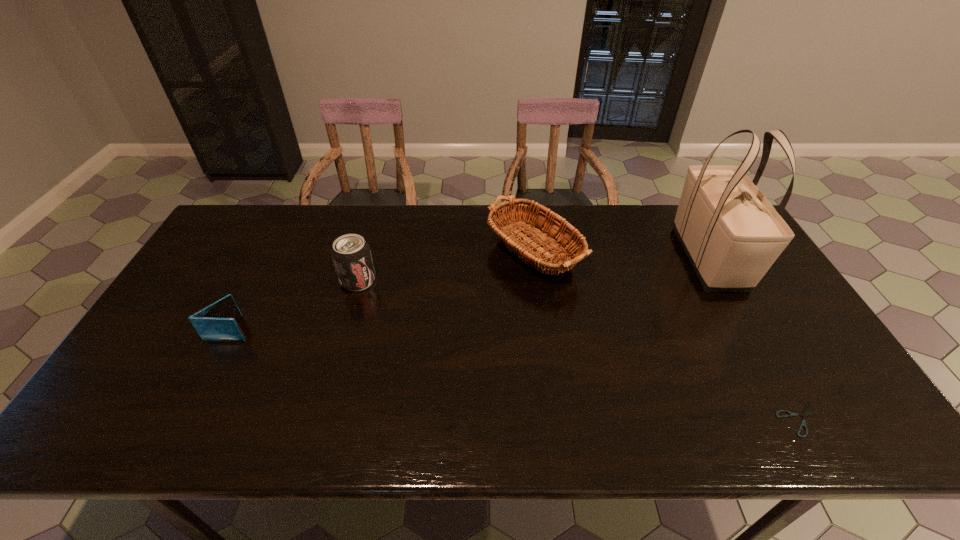
The height and width of the screenshot is (540, 960). I want to click on vacant space situated on the exterior surface of the leftmost object, so click(282, 329).

The image size is (960, 540). I want to click on free space located 0.230m on the back of the shears, so click(749, 325).

At what (x,y) coordinates should I click in order to perform the action: click on shopping bag situated at the far edge. Please return your answer as a coordinate pair (x, y). Looking at the image, I should click on (732, 235).

Identify the location of basket present at the far edge. This screenshot has width=960, height=540. 541,227.

This screenshot has width=960, height=540. Find the location of `object located in the near edge section of the desktop`. object located in the near edge section of the desktop is located at coordinates (803, 423).

Image resolution: width=960 pixels, height=540 pixels. I want to click on object located at the left edge, so click(x=217, y=322).

Where is `shopping bag located in the right edge section of the desktop`? shopping bag located in the right edge section of the desktop is located at coordinates (732, 235).

I want to click on shears present at the right edge, so click(x=803, y=423).

This screenshot has height=540, width=960. I want to click on object at the far right corner, so click(x=732, y=235).

I want to click on object located at the near right corner, so click(803, 423).